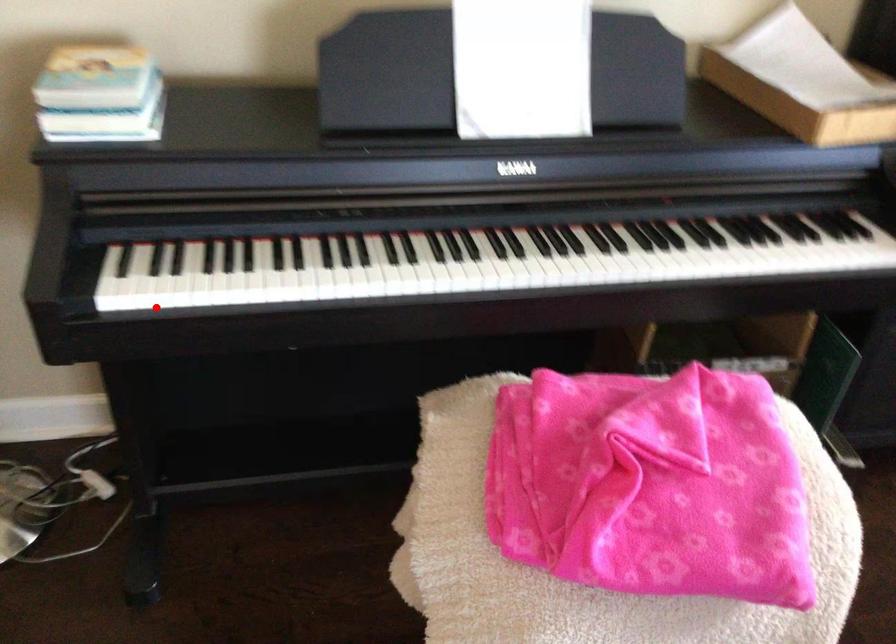
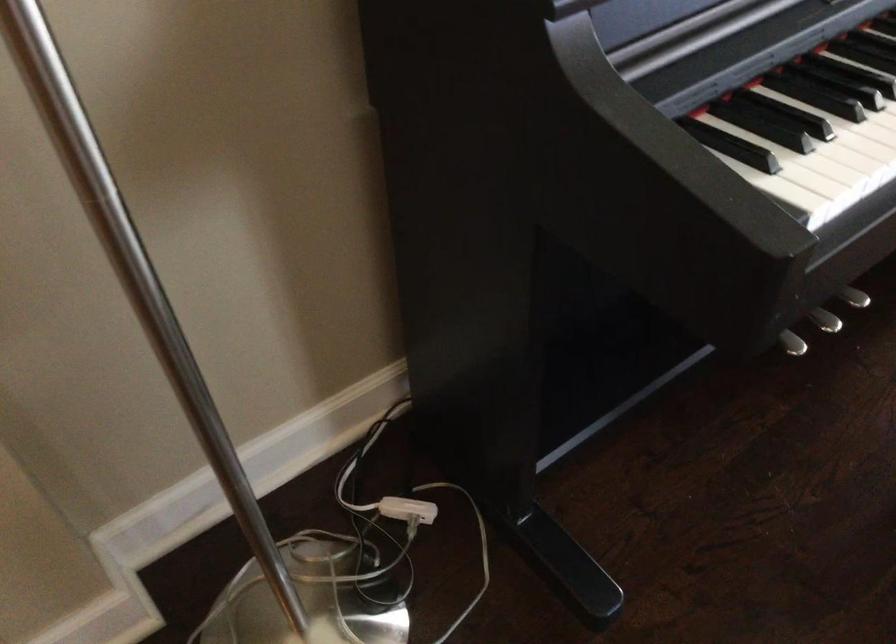
Question: I am providing you with two images of the same scene from different viewpoints. In image1, a red point is highlighted. Considering the same 3D point in image2, which of the following is correct?

Choices:
 (A) It is closer
 (B) It is farther

Answer: (A)